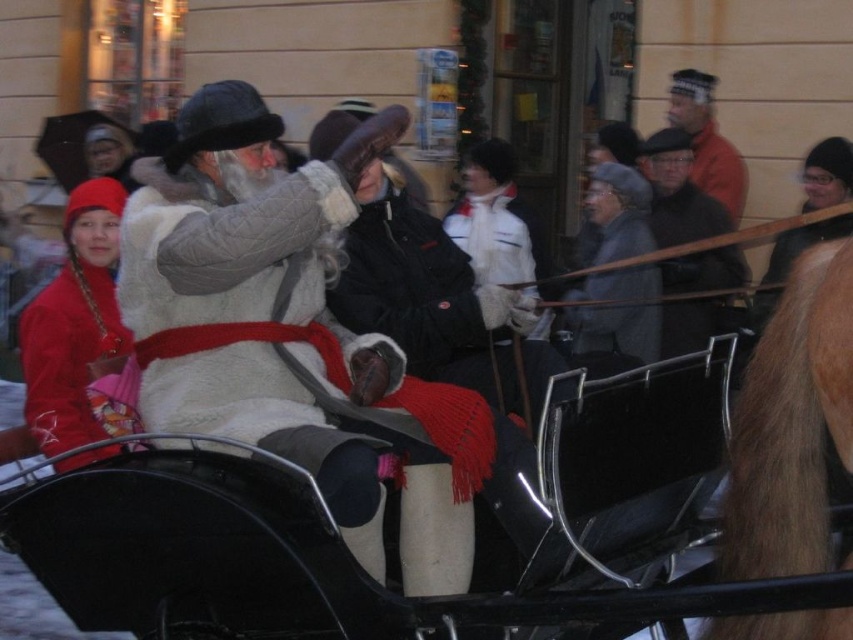
You are standing at the point marked by the coordinates point (250, 552) in the image. Looking around, you see the white fur coat at center. What object is located exactly at your current position?

The point (250, 552) corresponds to the white fur coat at center.

You are standing at the point with coordinates point (828, 163) and want to walk to the point with coordinates point (624, 252). Is the path between these two points clear of any obstacles?

The point (624, 252) is in front of point (828, 163), so the path between them is clear of obstacles.